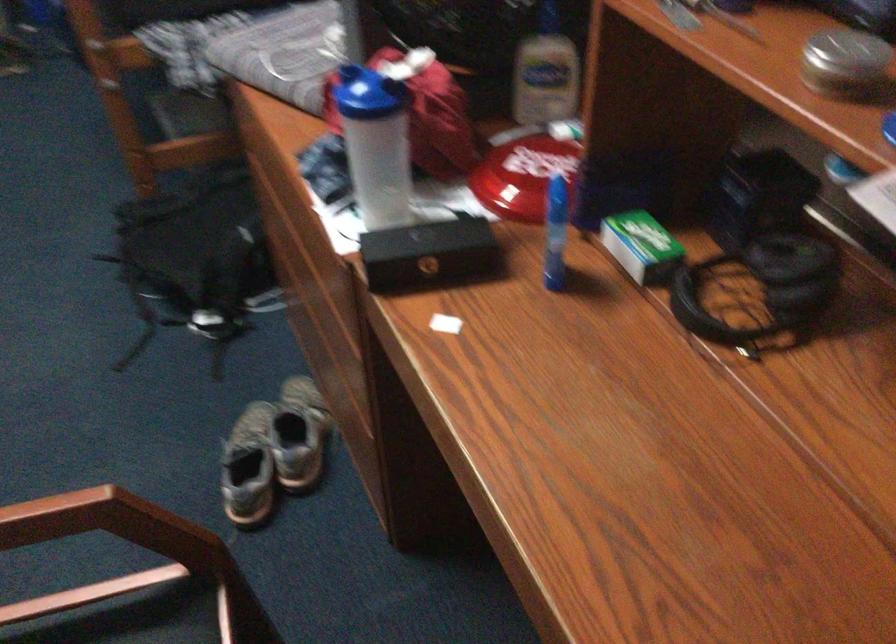
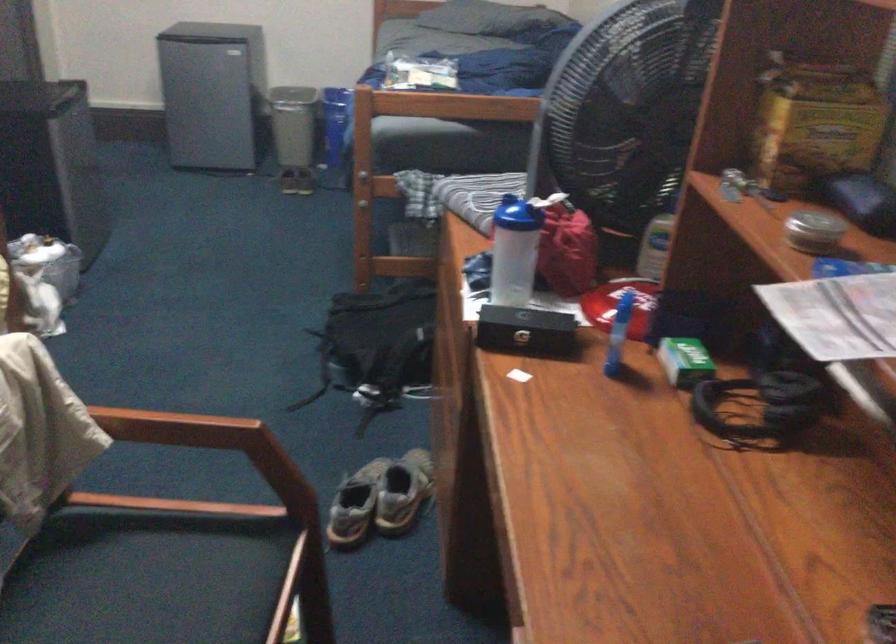
Find the pixel in the second image that matches point 297,435 in the first image.

(402, 491)